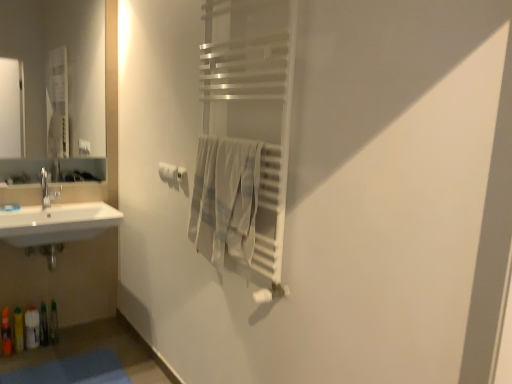
The width and height of the screenshot is (512, 384). Identify the location of vacant area that is situated to the right of translucent plastic bottles at lower left, the second toiletry when ordered from right to left. (62, 346).